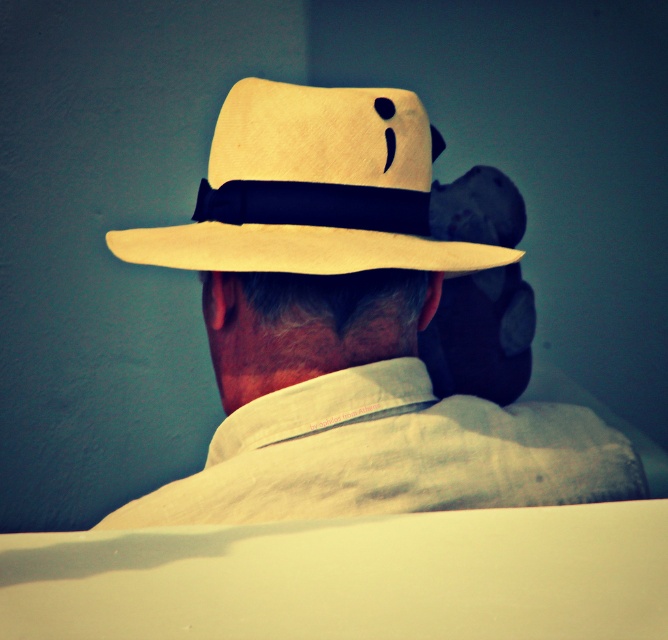
What do you see at coordinates (345, 330) in the screenshot? I see `matte straw hat at center` at bounding box center [345, 330].

Locate an element on the screen. matte straw hat at center is located at coordinates (345, 330).

Locate an element on the screen. Image resolution: width=668 pixels, height=640 pixels. matte straw hat at center is located at coordinates (345, 330).